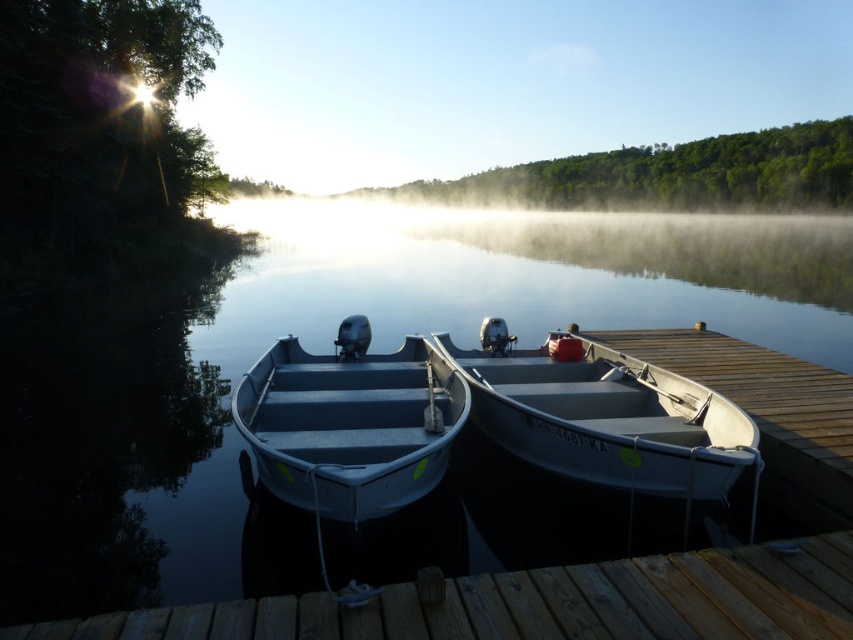
You are standing at the wooden pier and want to take a photo of both point (801, 598) and point (283, 360) in the scene. Which point should you focus on first to ensure both are in clear view?

You should focus on point (801, 598) first because it is closer to the camera than point (283, 360), ensuring both points are within the depth of field.

You are a photographer positioned at the origin of the image coordinate system. You want to capture a photo of the clear water at center. What are the coordinates where you should aim your camera?

The coordinates where you should aim your camera are at point [329,349].

You are standing on the wooden dock at center and want to see the clear water at center. In which direction should you look to see it?

The clear water at center is positioned over the wooden dock at center, so you should look downward to see it.